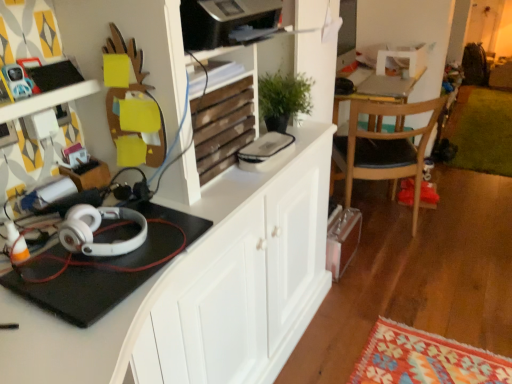
Question: From a real-world perspective, is green plush rug at lower right physically located above or below wooden at upper center?

Choices:
 (A) below
 (B) above

Answer: (A)

Question: Is green plush rug at lower right taller or shorter than wooden at upper center?

Choices:
 (A) tall
 (B) short

Answer: (B)

Question: Which of these objects is positioned closest to the wooden at upper center?

Choices:
 (A) green plush rug at lower right
 (B) white matte cabinet at center
 (C) wooden chair with black seat cushion at right
 (D) white matte headphones at left
 (E) matte black phone at upper left

Answer: (B)

Question: Estimate the real-world distances between objects in this image. Which object is farther from the white matte headphones at left?

Choices:
 (A) white matte cabinet at center
 (B) matte black phone at upper left
 (C) wooden at upper center
 (D) wooden chair with black seat cushion at right
 (E) green plush rug at lower right

Answer: (E)